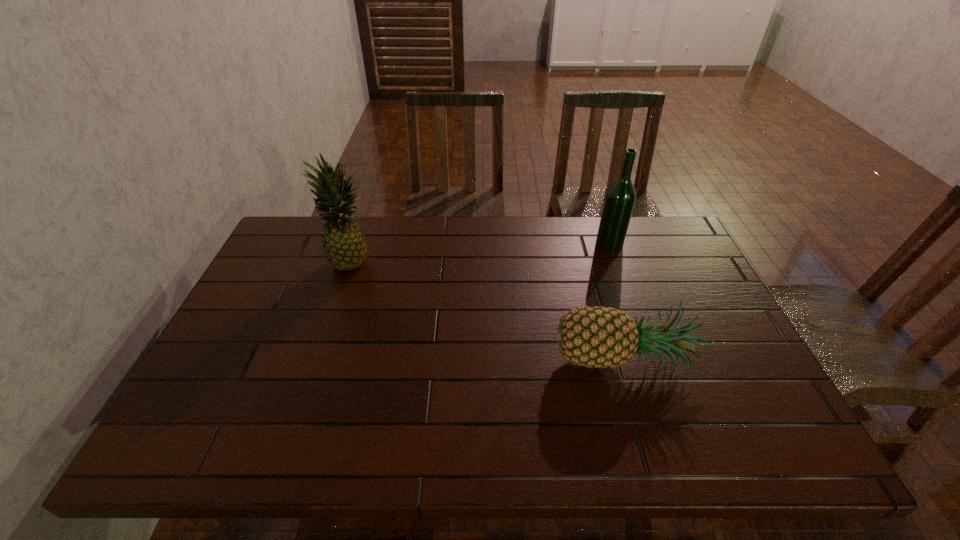
You are a GUI agent. You are given a task and a screenshot of the screen. Output one action in this format:
    pyautogui.click(x=<x>, y=<y>)
    Task: Click on the object located at the right edge
    Image resolution: width=960 pixels, height=540 pixels.
    Given the screenshot: What is the action you would take?
    (599, 337)

Locate an element on the screen. vacant space at the far edge of the desktop is located at coordinates (576, 222).

I want to click on vacant space at the near edge, so click(x=352, y=453).

In the image, there is a desktop. Where is `blank space at the left edge`? This screenshot has width=960, height=540. blank space at the left edge is located at coordinates (262, 321).

This screenshot has height=540, width=960. In the image, there is a desktop. Find the location of `vacant area at the right edge`. vacant area at the right edge is located at coordinates (663, 307).

In the image, there is a desktop. Where is `vacant space at the near left corner`? vacant space at the near left corner is located at coordinates (180, 435).

This screenshot has width=960, height=540. I want to click on vacant space at the far right corner, so pos(665,235).

You are a GUI agent. You are given a task and a screenshot of the screen. Output one action in this format:
    pyautogui.click(x=<x>, y=<y>)
    Task: Click on the vacant point at the near right corner
    
    Given the screenshot: What is the action you would take?
    pyautogui.click(x=736, y=454)

The height and width of the screenshot is (540, 960). I want to click on free area in between the left pineapple and the right pineapple, so pos(487,310).

Locate an element on the screen. vacant point located between the nearer pineapple and the alcohol is located at coordinates (616, 302).